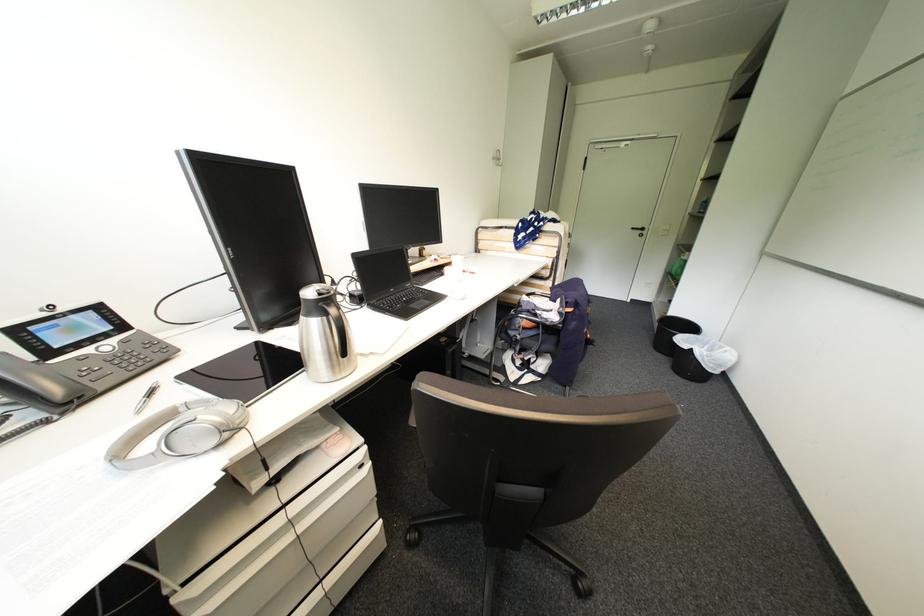
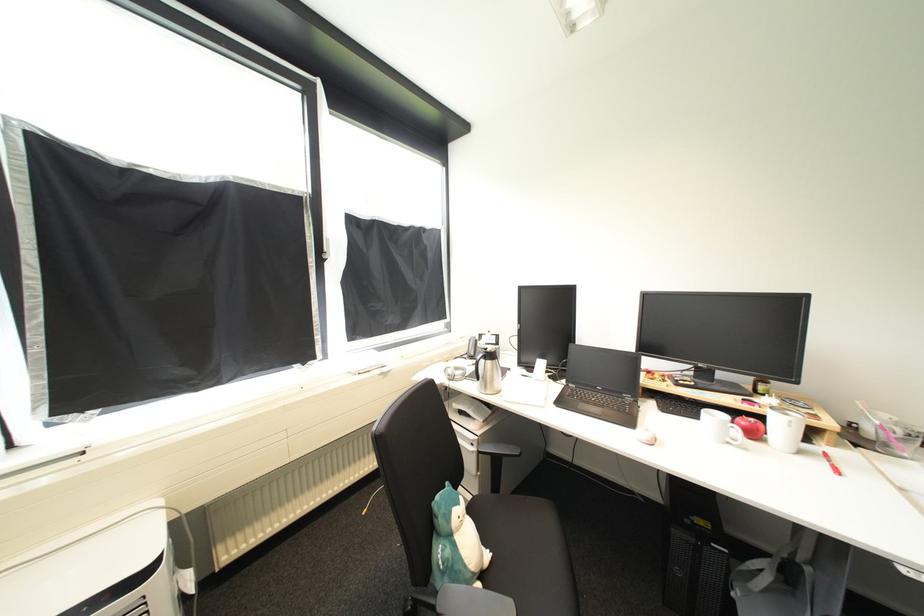
Where in the second image is the point corresponding to [475,274] from the first image?

(834, 464)